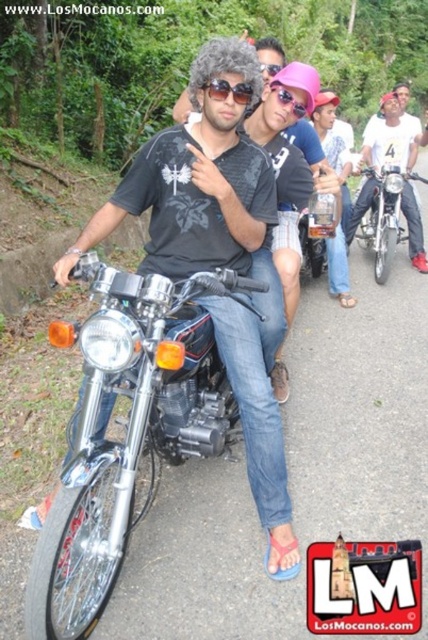
Question: Which point is closer to the camera?

Choices:
 (A) matte black shirt at center
 (B) sunglassestransparent at upper center
 (C) shiny chrome motorcycle at center
 (D) chrome/metallic motorcycle at center

Answer: (D)

Question: Is shiny chrome motorcycle at center thinner than glossy plastic goggles at center?

Choices:
 (A) no
 (B) yes

Answer: (A)

Question: Among these points, which one is farthest from the camera?

Choices:
 (A) (255, 364)
 (B) (198, 451)

Answer: (B)

Question: Can you confirm if sunglasses at center is positioned to the left of sunglassestransparent at upper center?

Choices:
 (A) no
 (B) yes

Answer: (B)

Question: Which of these objects is positioned farthest from the shiny chrome motorcycle at center?

Choices:
 (A) chrome/metallic motorcycle at center
 (B) matte black shirt at center

Answer: (A)

Question: Is shiny chrome motorcycle at center above glossy plastic goggles at center?

Choices:
 (A) no
 (B) yes

Answer: (A)